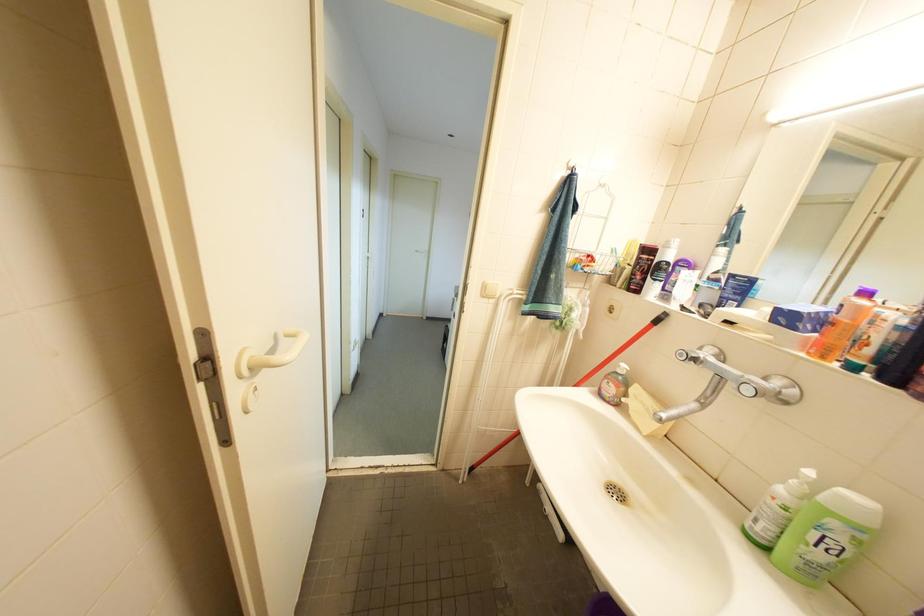
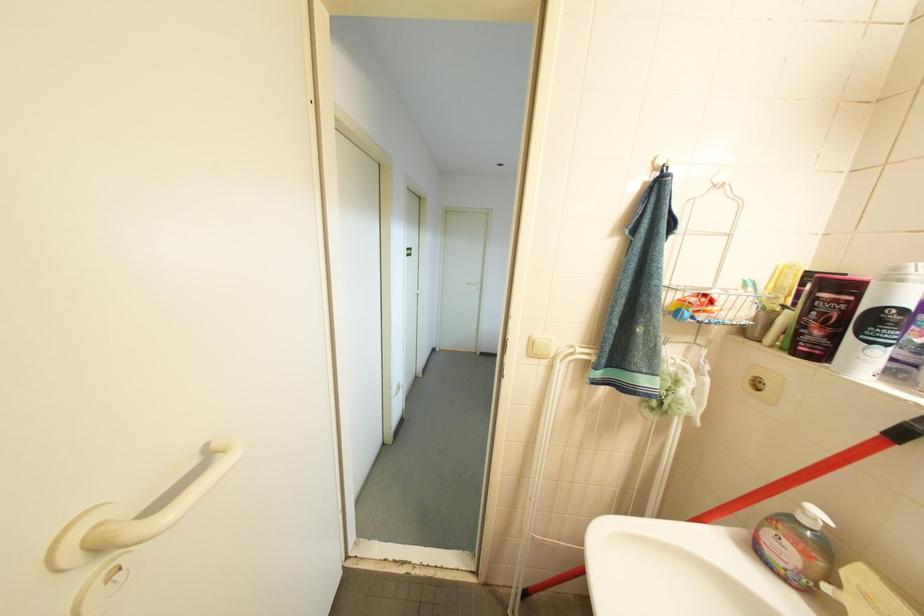
Question: What movement of the cameraman would produce the second image?

Choices:
 (A) Left
 (B) Right
 (C) Forward
 (D) Backward

Answer: (C)